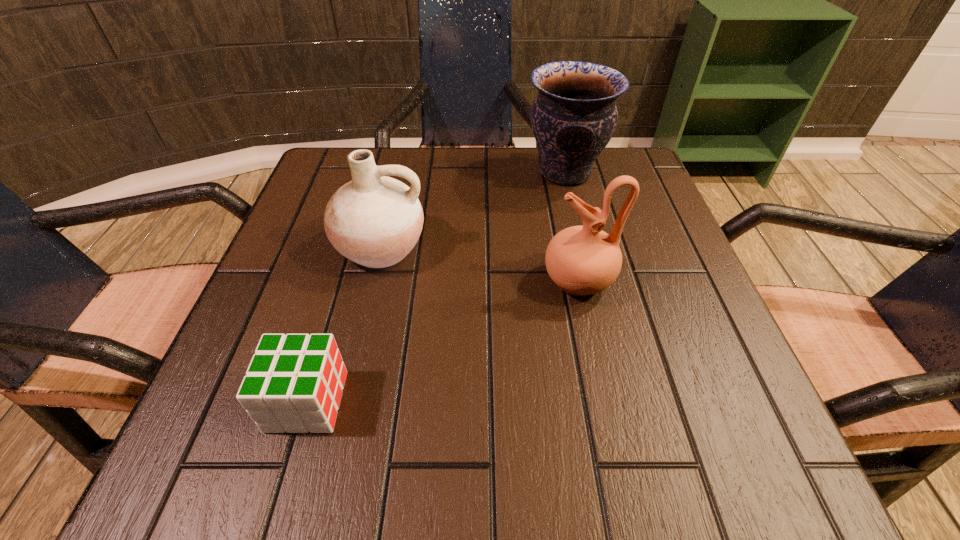
You are a GUI agent. You are given a task and a screenshot of the screen. Output one action in this format:
    pyautogui.click(x=<x>, y=<y>)
    Task: Click on the object located at the near edge
    The width and height of the screenshot is (960, 540).
    Given the screenshot: What is the action you would take?
    pyautogui.click(x=294, y=382)

Where is `pottery at the left edge`? This screenshot has width=960, height=540. pottery at the left edge is located at coordinates (374, 220).

I want to click on cube present at the left edge, so click(x=294, y=382).

Where is `object present at the near left corner`? object present at the near left corner is located at coordinates (294, 382).

I want to click on object that is at the far right corner, so coord(574,117).

Identify the location of vacant space at the far edge of the desktop. Image resolution: width=960 pixels, height=540 pixels. (479, 149).

Where is `free space at the near edge of the desktop`? The height and width of the screenshot is (540, 960). free space at the near edge of the desktop is located at coordinates (556, 447).

The height and width of the screenshot is (540, 960). What are the coordinates of `vacant space at the left edge of the desktop` in the screenshot? It's located at click(x=299, y=246).

Find the location of a particular element. The height and width of the screenshot is (540, 960). vacant space at the right edge of the desktop is located at coordinates (618, 281).

The image size is (960, 540). What are the coordinates of `vacant space at the far left corner of the desktop` in the screenshot? It's located at (352, 151).